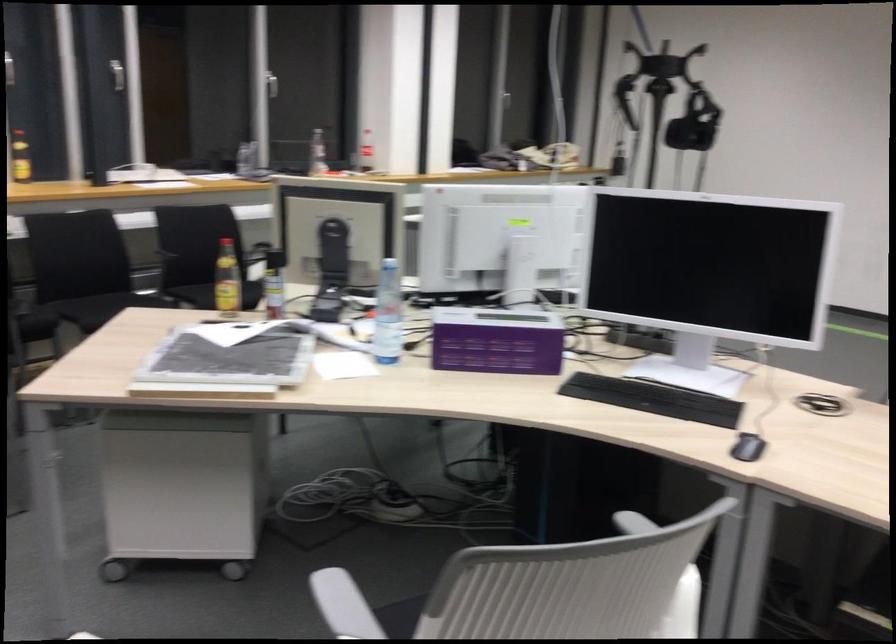
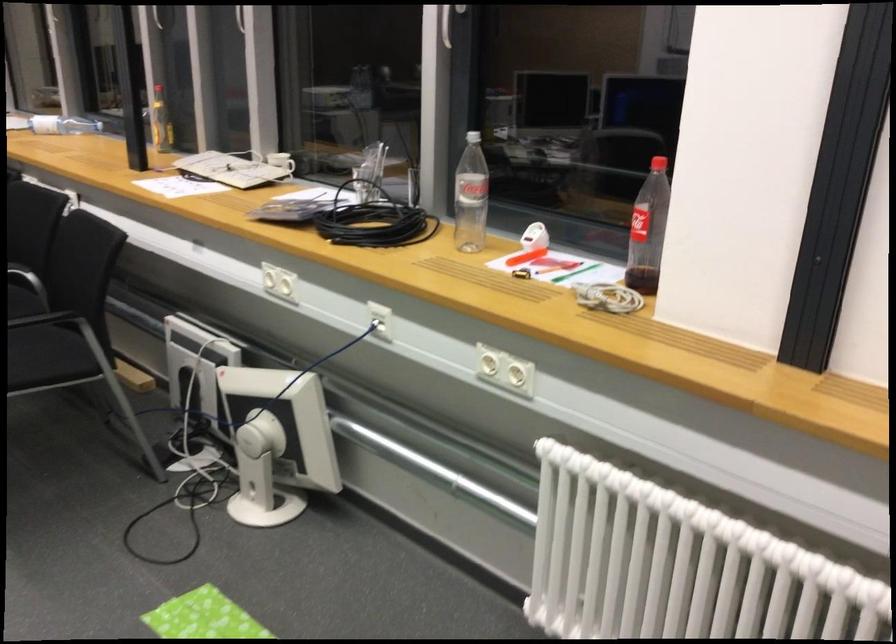
Locate, in the second image, the point that corresponds to the point at 359,147 in the first image.

(648, 230)